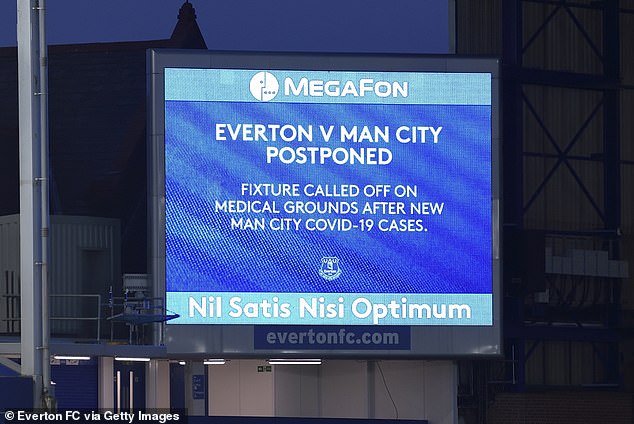
Where is `white square pillar`? The width and height of the screenshot is (634, 424). white square pillar is located at coordinates (103, 377), (156, 385), (33, 245).